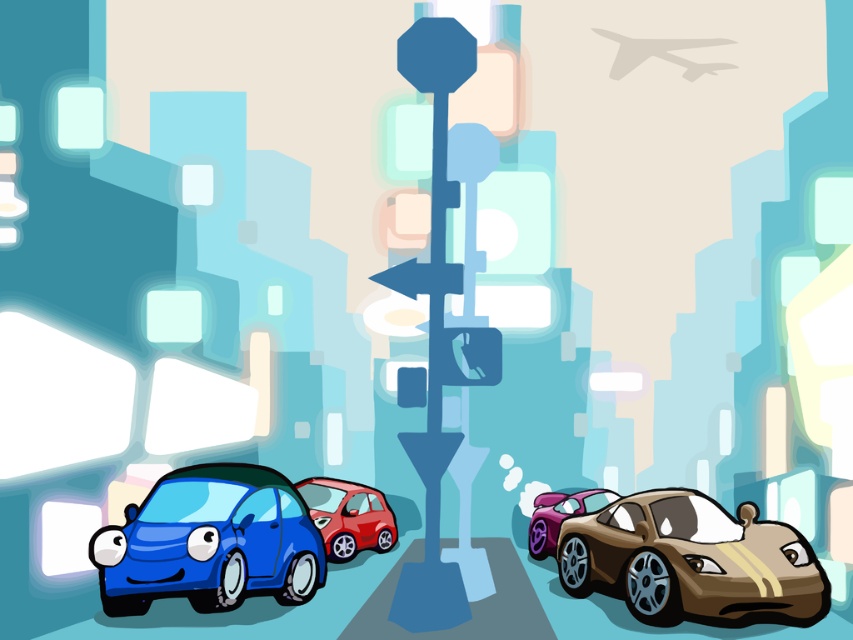
You are a delivery robot that needs to navigate between the shiny gold sports car at lower right and the purple metallic sports car at right. The robot requires a minimum of 10 feet of space to pass safely. Based on the scene, can you determine if there is enough space for the robot to move through?

The distance between the shiny gold sports car at lower right and the purple metallic sports car at right is 10.49 feet, which is just over the required 10 feet. Therefore, the delivery robot has sufficient space to navigate safely between them.

Please provide the 2D coordinates of the glossy plastic car at lower left in the image. The coordinates should be in the format of a point with two decimal places, such as point 0.848, 0.247.

The glossy plastic car at lower left is located at point (210,541).